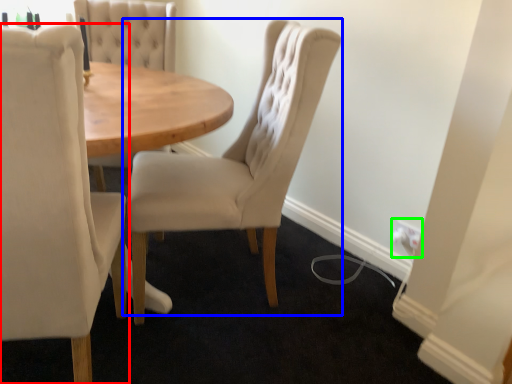
Question: Based on their relative distances, which object is nearer to chair (highlighted by a red box)? Choose from chair (highlighted by a blue box) and electric outlet (highlighted by a green box).

Choices:
 (A) chair
 (B) electric outlet

Answer: (A)